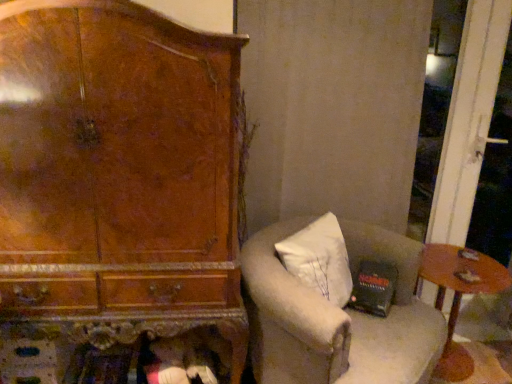
Question: Considering the relative positions of wooden round table at lower right and white fabric chair at center in the image provided, is wooden round table at lower right to the left of white fabric chair at center from the viewer's perspective?

Choices:
 (A) yes
 (B) no

Answer: (B)

Question: From the image's perspective, is wooden round table at lower right beneath white fabric chair at center?

Choices:
 (A) no
 (B) yes

Answer: (B)

Question: Is wooden round table at lower right wider than white fabric chair at center?

Choices:
 (A) yes
 (B) no

Answer: (B)

Question: Can you confirm if wooden round table at lower right is taller than white fabric chair at center?

Choices:
 (A) yes
 (B) no

Answer: (B)

Question: Is wooden round table at lower right positioned far away from white fabric chair at center?

Choices:
 (A) no
 (B) yes

Answer: (A)

Question: Is white fabric chair at center at the back of wooden round table at lower right?

Choices:
 (A) no
 (B) yes

Answer: (A)

Question: Is white fabric chair at center not near wooden round table at lower right?

Choices:
 (A) no
 (B) yes

Answer: (A)

Question: From the image's perspective, does white fabric chair at center appear lower than wooden round table at lower right?

Choices:
 (A) no
 (B) yes

Answer: (A)

Question: Considering the relative sizes of white fabric chair at center and wooden round table at lower right in the image provided, is white fabric chair at center taller than wooden round table at lower right?

Choices:
 (A) yes
 (B) no

Answer: (A)

Question: From the image's perspective, does white fabric chair at center appear higher than wooden round table at lower right?

Choices:
 (A) yes
 (B) no

Answer: (A)

Question: Does white fabric chair at center have a smaller size compared to wooden round table at lower right?

Choices:
 (A) no
 (B) yes

Answer: (A)

Question: Can you confirm if white fabric chair at center is positioned to the left of wooden round table at lower right?

Choices:
 (A) yes
 (B) no

Answer: (A)

Question: Considering the positions of point (453, 289) and point (261, 233), is point (453, 289) closer or farther from the camera than point (261, 233)?

Choices:
 (A) farther
 (B) closer

Answer: (A)